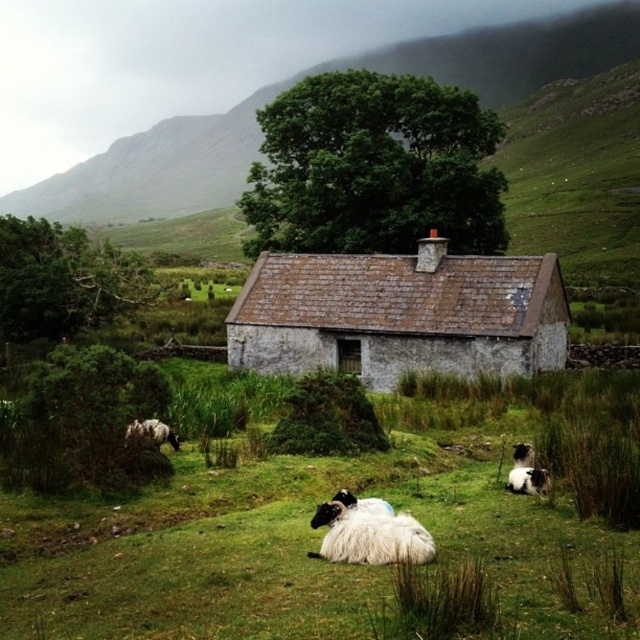
Between point (492, 349) and point (369, 522), which one is positioned in front?

Point (369, 522)

Between rustic stone barn at center and white woolly sheep at center, which one is positioned higher?

rustic stone barn at center

I want to click on rustic stone barn at center, so click(x=400, y=314).

Can you confirm if white woolly sheep at center is smaller than white woolly sheep at lower left?

Actually, white woolly sheep at center might be larger than white woolly sheep at lower left.

Does white woolly sheep at center have a lesser width compared to white woolly sheep at lower left?

No.

Locate an element on the screen. The width and height of the screenshot is (640, 640). white woolly sheep at center is located at coordinates (371, 536).

Is point (372, 531) positioned after point (544, 490)?

That is False.

Is point (429, 554) closer to viewer compared to point (522, 486)?

Yes, point (429, 554) is closer to viewer.

This screenshot has width=640, height=640. What are the coordinates of `white woolly sheep at center` in the screenshot? It's located at (371, 536).